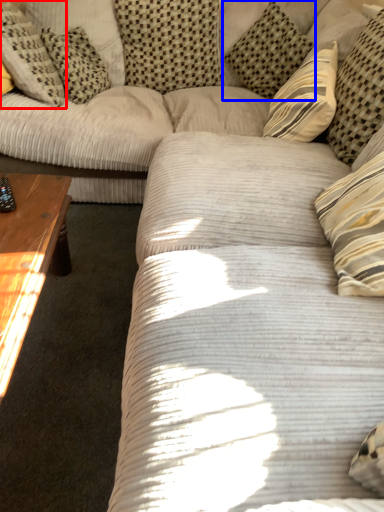
Question: Which of the following is the closest to the observer, pillow (highlighted by a red box) or pillow (highlighted by a blue box)?

Choices:
 (A) pillow
 (B) pillow

Answer: (A)